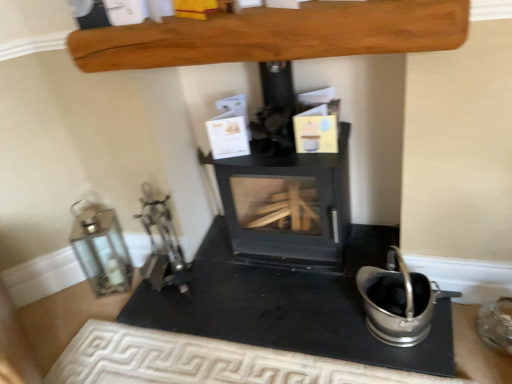
Identify the location of vacant space underneath satin silver bucket at lower right, acting as the second appliance starting from the right (from a real-world perspective). (411, 332).